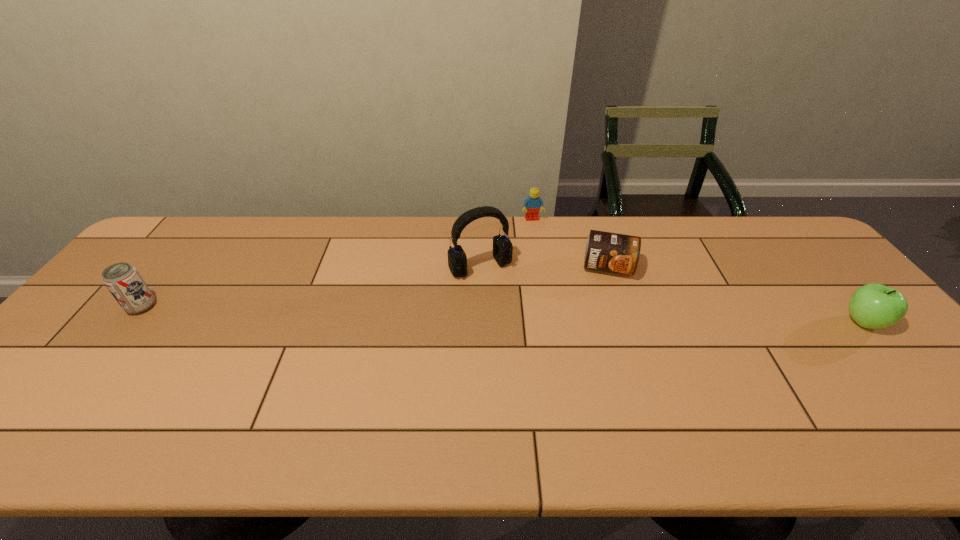
Where is `free space located on the face of the farthest object`? Image resolution: width=960 pixels, height=540 pixels. free space located on the face of the farthest object is located at coordinates (556, 301).

Where is `free space located on the face of the farthest object`? free space located on the face of the farthest object is located at coordinates (555, 296).

The image size is (960, 540). Find the location of `vacant space located 0.370m on the headband of the headset`. vacant space located 0.370m on the headband of the headset is located at coordinates (555, 381).

Identify the location of vacant point located on the headband of the headset. (502, 298).

Where is `vacant space located 0.050m on the headband of the headset`? This screenshot has height=540, width=960. vacant space located 0.050m on the headband of the headset is located at coordinates (499, 293).

What are the coordinates of `free spot located on the front label of the second object from right to left` in the screenshot? It's located at (602, 343).

I want to click on free spot located on the front label of the second object from right to left, so click(x=598, y=389).

This screenshot has height=540, width=960. In order to click on free location located on the front label of the second object from right to left in this screenshot , I will do `click(602, 343)`.

The image size is (960, 540). In order to click on Lego that is at the far edge in this screenshot , I will do `click(532, 204)`.

The width and height of the screenshot is (960, 540). I want to click on headset that is at the far edge, so click(x=502, y=247).